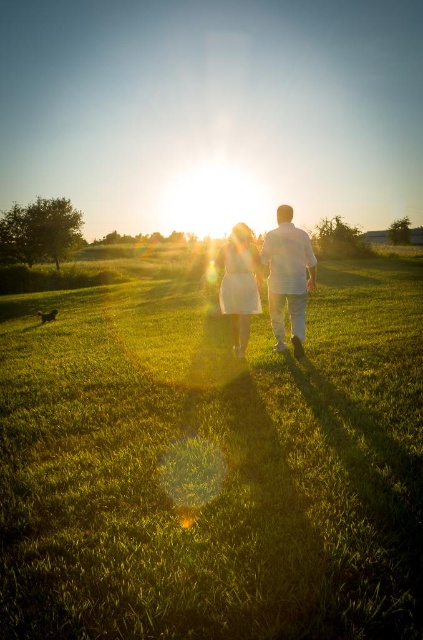
Which of these two, green grassy field at center or white cotton shirt at center, stands shorter?

Standing shorter between the two is green grassy field at center.

What are the coordinates of `green grassy field at center` in the screenshot? It's located at (213, 464).

You are a GUI agent. You are given a task and a screenshot of the screen. Output one action in this format:
    pyautogui.click(x=<x>, y=<y>)
    Task: Click on the green grassy field at center
    
    Given the screenshot: What is the action you would take?
    pyautogui.click(x=213, y=464)

Is white cotton shirt at center smaller than white matte dress at center?

Correct, white cotton shirt at center occupies less space than white matte dress at center.

Which is behind, point (285, 216) or point (255, 282)?

The point (255, 282) is behind.

Between point (301, 317) and point (258, 296), which one is positioned behind?

The point (258, 296) is more distant.

Identify the location of white cotton shirt at center. Image resolution: width=423 pixels, height=640 pixels. (288, 276).

At what (x,y) coordinates should I click in order to perform the action: click on green grassy field at center. Please return your answer as a coordinate pair (x, y). This screenshot has width=423, height=640. Looking at the image, I should click on (213, 464).

Looking at this image, is green grassy field at center to the right of white matte dress at center from the viewer's perspective?

In fact, green grassy field at center is to the left of white matte dress at center.

The height and width of the screenshot is (640, 423). Identify the location of green grassy field at center. (213, 464).